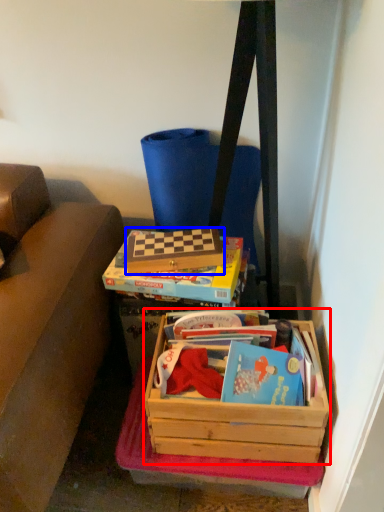
Question: Among these objects, which one is nearest to the camera, box (highlighted by a red box) or box (highlighted by a blue box)?

Choices:
 (A) box
 (B) box

Answer: (A)